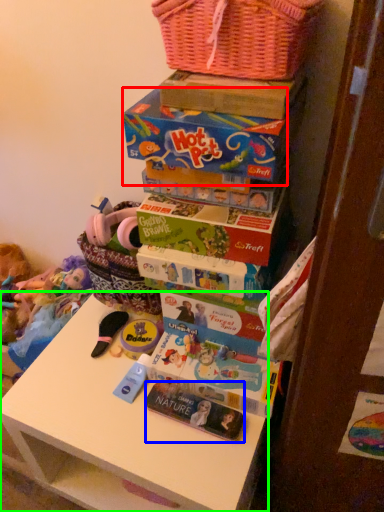
Question: Which object is positioned closest to storage box (highlighted by a red box)? Select from magazine (highlighted by a blue box) and table (highlighted by a green box).

Choices:
 (A) magazine
 (B) table

Answer: (A)